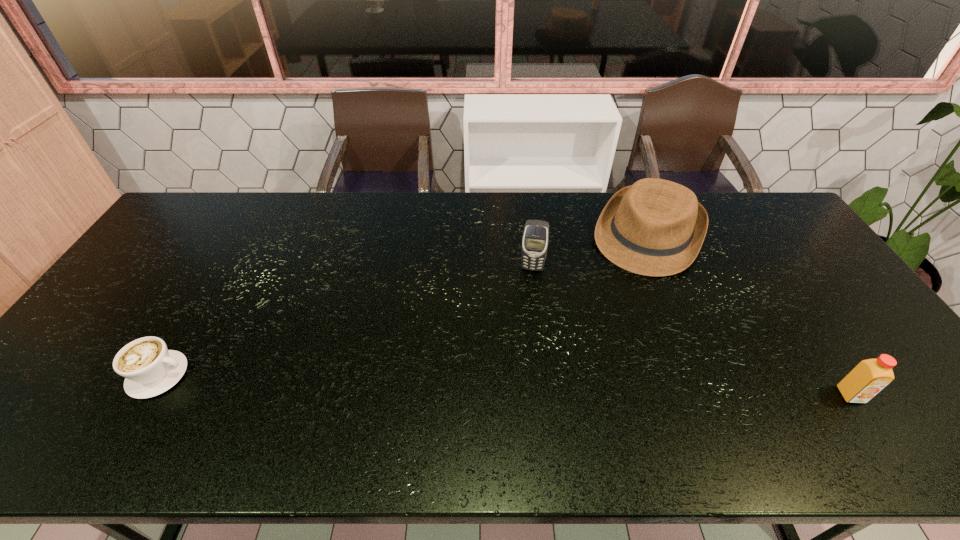
Image resolution: width=960 pixels, height=540 pixels. I want to click on free space at the left edge, so click(106, 314).

Identify the location of vacant region at the right edge of the desktop. (793, 286).

Where is `free space at the near left corner of the desktop`? This screenshot has height=540, width=960. free space at the near left corner of the desktop is located at coordinates (71, 408).

Locate an element on the screen. vacant region at the near right corner of the desktop is located at coordinates (903, 401).

Find the location of a particular element. This screenshot has height=540, width=960. free space that is in between the leftmost object and the rightmost object is located at coordinates (505, 385).

Where is `free spot between the shortest object and the orange juice`? free spot between the shortest object and the orange juice is located at coordinates (505, 385).

Where is `unoccupied area between the cappuccino and the tallest object`? unoccupied area between the cappuccino and the tallest object is located at coordinates (346, 321).

Find the location of a particular element. The height and width of the screenshot is (540, 960). vacant point located between the cappuccino and the tallest object is located at coordinates (346, 321).

Where is `free point between the third object from left to right and the leftmost object`? The width and height of the screenshot is (960, 540). free point between the third object from left to right and the leftmost object is located at coordinates (403, 305).

Locate an element on the screen. vacant area that lies between the orange juice and the third object from left to right is located at coordinates (749, 315).